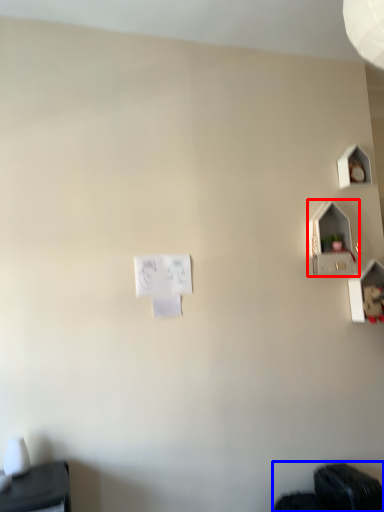
Question: Which object appears farthest to the camera in this image, twin (highlighted by a red box) or wide (highlighted by a blue box)?

Choices:
 (A) twin
 (B) wide

Answer: (A)